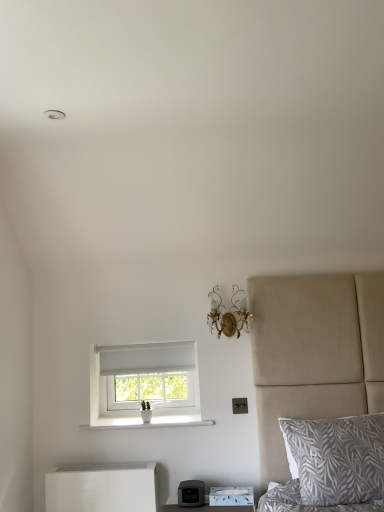
Question: Could you tell me if gray leaf-patterned pillow at lower right is facing gold crystal sconce at upper center?

Choices:
 (A) yes
 (B) no

Answer: (B)

Question: Considering the relative sizes of gray leaf-patterned pillow at lower right and gold crystal sconce at upper center in the image provided, is gray leaf-patterned pillow at lower right taller than gold crystal sconce at upper center?

Choices:
 (A) yes
 (B) no

Answer: (A)

Question: Does gray leaf-patterned pillow at lower right come behind gold crystal sconce at upper center?

Choices:
 (A) no
 (B) yes

Answer: (A)

Question: From a real-world perspective, is gray leaf-patterned pillow at lower right located higher than gold crystal sconce at upper center?

Choices:
 (A) no
 (B) yes

Answer: (A)

Question: Does gray leaf-patterned pillow at lower right have a larger size compared to gold crystal sconce at upper center?

Choices:
 (A) no
 (B) yes

Answer: (B)

Question: In terms of height, does white matte nightstand at lower left look taller or shorter compared to white ceramic vase at lower center?

Choices:
 (A) short
 (B) tall

Answer: (B)

Question: Is white matte nightstand at lower left wider or thinner than white ceramic vase at lower center?

Choices:
 (A) wide
 (B) thin

Answer: (B)

Question: From a real-world perspective, is white matte nightstand at lower left physically located above or below white ceramic vase at lower center?

Choices:
 (A) below
 (B) above

Answer: (A)

Question: Is white matte nightstand at lower left in front of or behind white ceramic vase at lower center in the image?

Choices:
 (A) front
 (B) behind

Answer: (A)

Question: From their relative heights in the image, would you say gray leaf-patterned pillow at lower right is taller or shorter than matte black printer at lower center?

Choices:
 (A) short
 (B) tall

Answer: (B)

Question: Considering the positions of gray leaf-patterned pillow at lower right and matte black printer at lower center in the image, is gray leaf-patterned pillow at lower right bigger or smaller than matte black printer at lower center?

Choices:
 (A) big
 (B) small

Answer: (A)

Question: From a real-world perspective, is gray leaf-patterned pillow at lower right above or below matte black printer at lower center?

Choices:
 (A) below
 (B) above

Answer: (B)

Question: In the image, is gray leaf-patterned pillow at lower right on the left side or the right side of matte black printer at lower center?

Choices:
 (A) right
 (B) left

Answer: (A)

Question: Considering the positions of white matte nightstand at lower left and white fabric window at center in the image, is white matte nightstand at lower left bigger or smaller than white fabric window at center?

Choices:
 (A) big
 (B) small

Answer: (B)

Question: In the image, is white matte nightstand at lower left positioned in front of or behind white fabric window at center?

Choices:
 (A) front
 (B) behind

Answer: (A)